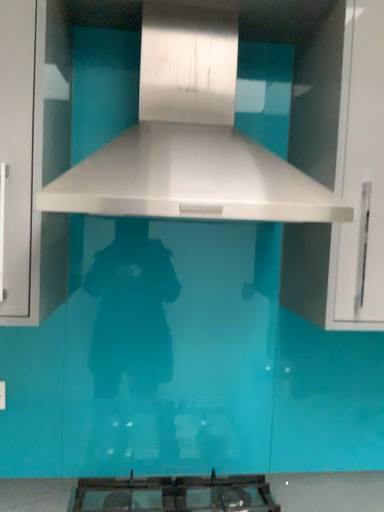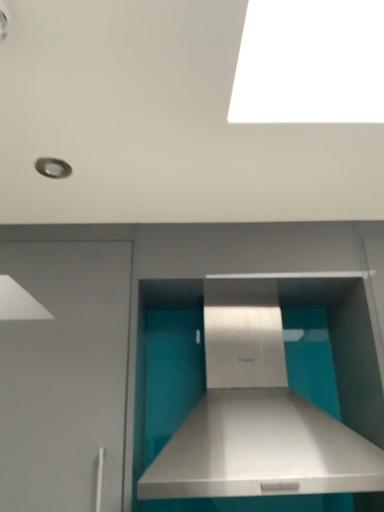
Question: Which way did the camera rotate in the video?

Choices:
 (A) rotated upward
 (B) rotated downward

Answer: (A)